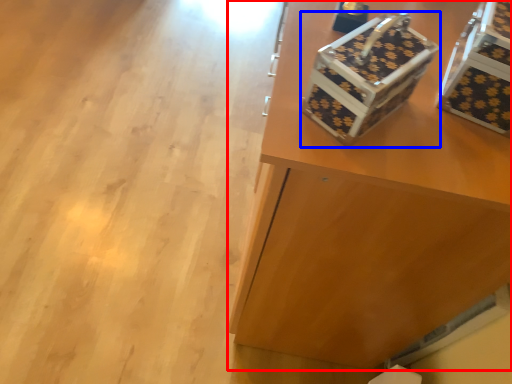
Question: Which object is closer to the camera taking this photo, furniture (highlighted by a red box) or shoe box (highlighted by a blue box)?

Choices:
 (A) furniture
 (B) shoe box

Answer: (B)